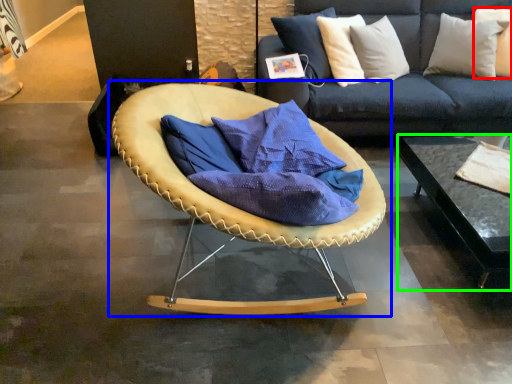
Question: Based on their relative distances, which object is farther from pillow (highlighted by a red box)? Choose from chair (highlighted by a blue box) and table (highlighted by a green box).

Choices:
 (A) chair
 (B) table

Answer: (A)